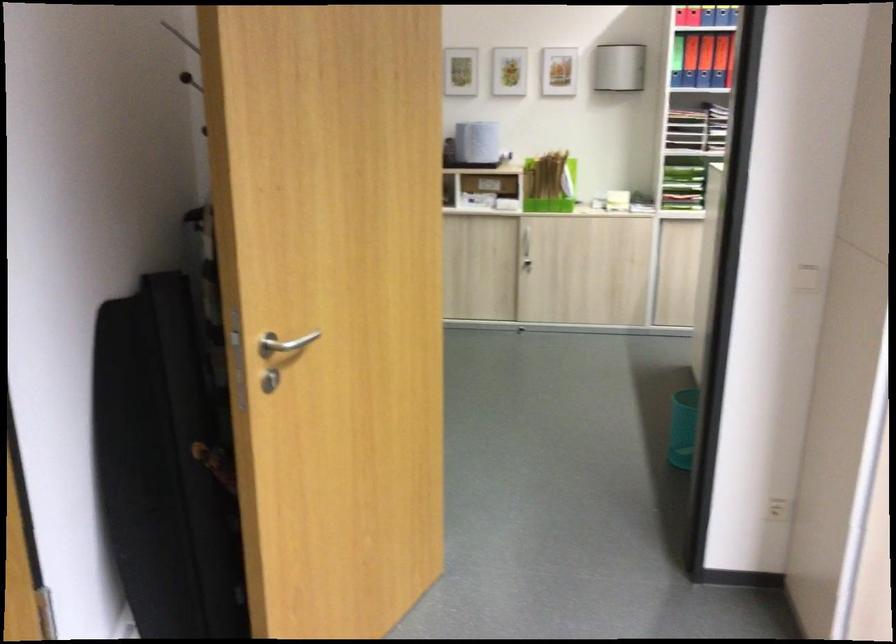
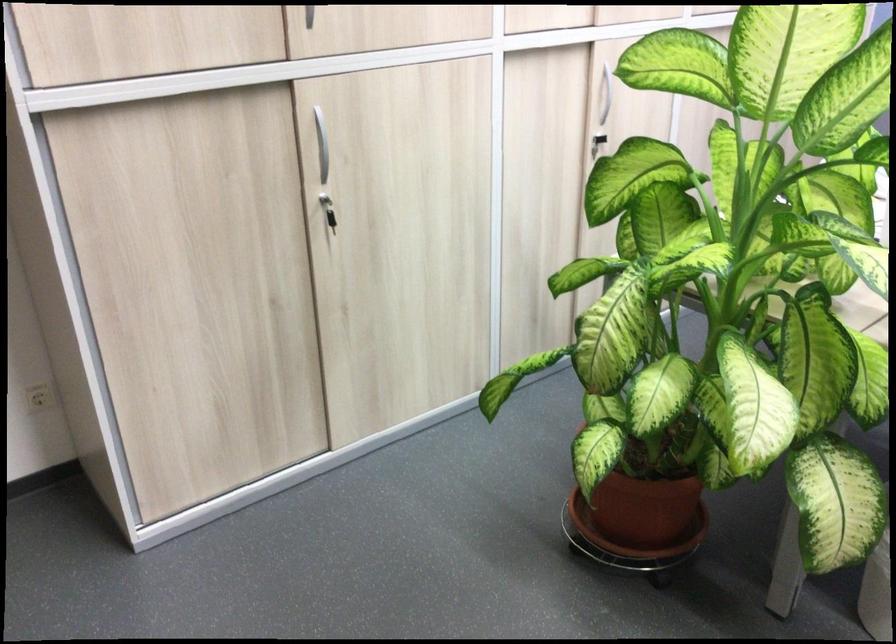
Locate, in the second image, the point that corresponds to [777,498] in the first image.

(39, 397)